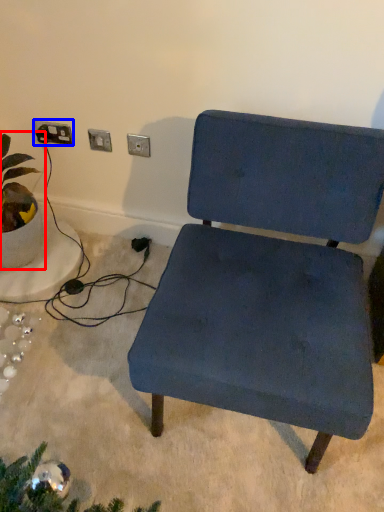
Question: Which point is closer to the camera, houseplant (highlighted by a red box) or electric outlet (highlighted by a blue box)?

Choices:
 (A) houseplant
 (B) electric outlet

Answer: (A)